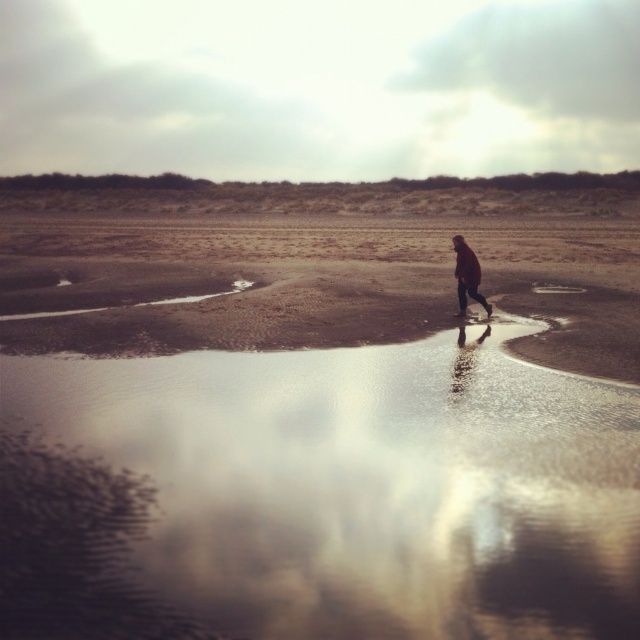
Question: Which object is farther from the camera taking this photo?

Choices:
 (A) glossy reflective puddle at center
 (B) matte brown coat at center
 (C) glossy reflective water at center

Answer: (A)

Question: Observing the image, what is the correct spatial positioning of matte brown coat at center in reference to glossy reflective puddle at center?

Choices:
 (A) below
 (B) above

Answer: (B)

Question: Which object is closer to the camera taking this photo?

Choices:
 (A) matte brown coat at center
 (B) glossy reflective water at center

Answer: (B)

Question: Which of these objects is positioned closest to the glossy reflective puddle at center?

Choices:
 (A) glossy reflective water at center
 (B) matte brown coat at center

Answer: (B)

Question: Can you confirm if glossy reflective water at center is positioned to the left of glossy reflective puddle at center?

Choices:
 (A) yes
 (B) no

Answer: (A)

Question: Is glossy reflective water at center to the right of glossy reflective puddle at center from the viewer's perspective?

Choices:
 (A) no
 (B) yes

Answer: (A)